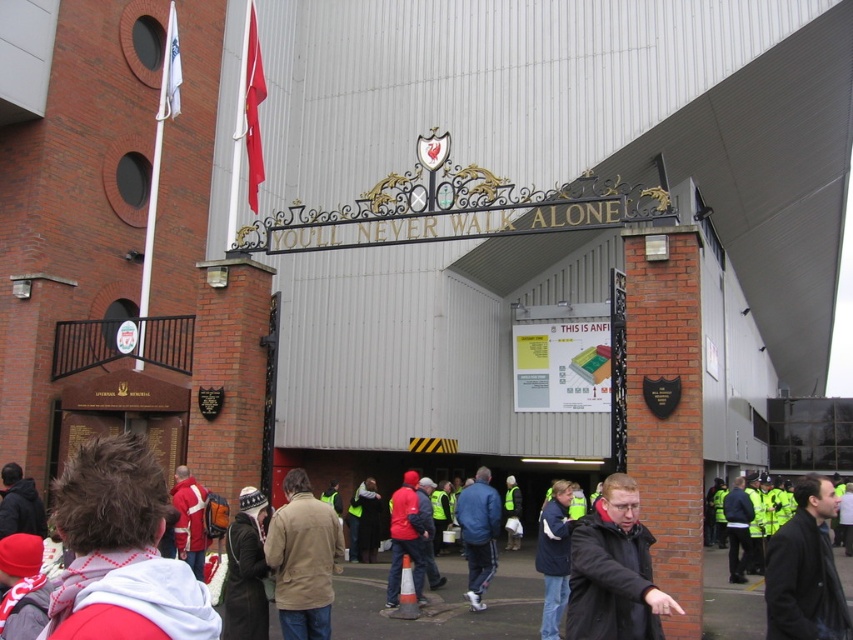
You are a security guard at Anfield Stadium and need to place two jackets at the entrance. The matte black jacket at center and the dark brown leather jacket at center must be positioned so that the smaller one is closer to the entrance. Which jacket should be placed closer?

The matte black jacket at center should be placed closer to the entrance because it occupies less space than the dark brown leather jacket at center, making it the smaller one.

You are a photographer standing at the entrance of Anfield Stadium. You see a blue fabric jacket at center and a red matte jacket at center. Which jacket should you focus on if you want to capture the one that takes up less space in the frame?

The blue fabric jacket at center has a smaller size compared to the red matte jacket at center, so you should focus on the blue fabric jacket at center to capture the one that takes up less space in the frame.